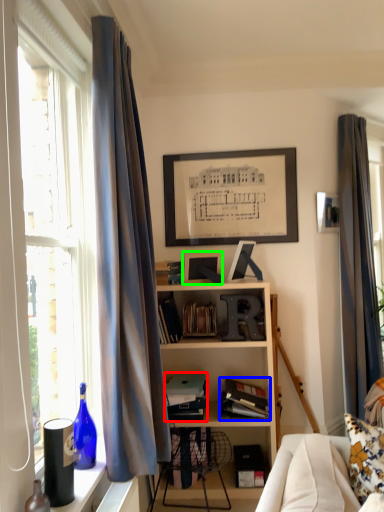
Question: Which object is the closest to the book (highlighted by a red box)? Choose among these: book (highlighted by a blue box) or picture frame (highlighted by a green box).

Choices:
 (A) book
 (B) picture frame

Answer: (A)